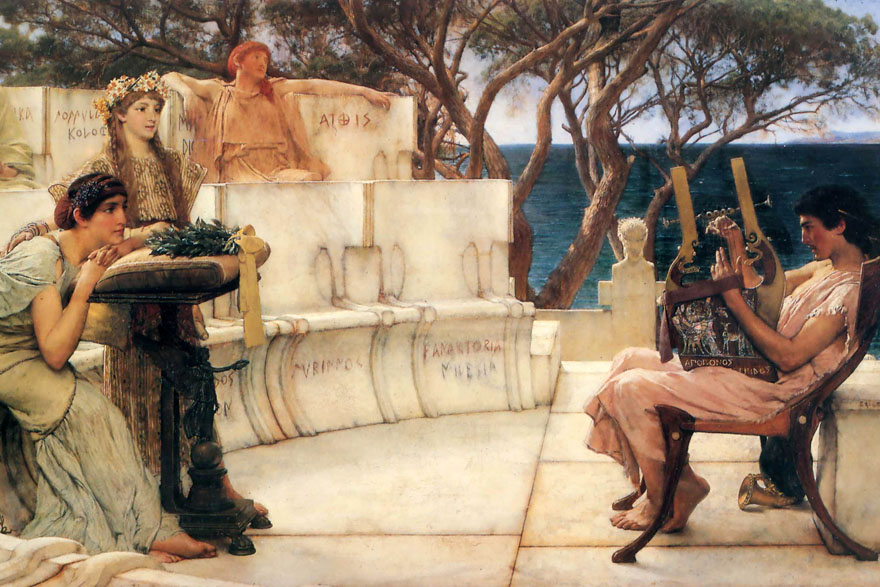
Image resolution: width=880 pixels, height=587 pixels. I want to click on pillow, so click(x=137, y=268).